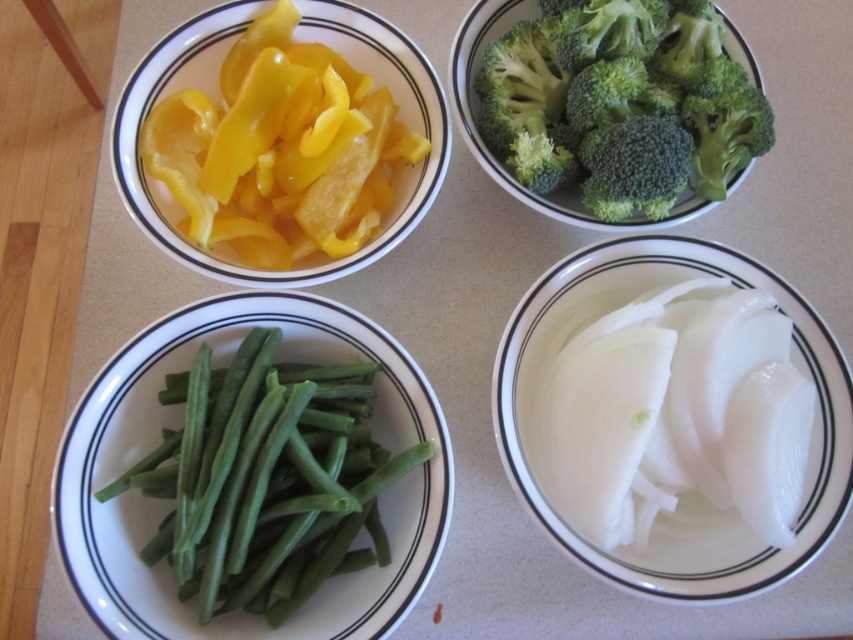
Which bowl is located at the coordinates point (178, 422)?

The green matte green beans at lower left is located at point (178, 422).

You are standing in front of the countertop with the bowls. Which bowl is closer to you, the green matte green beans at lower left or the yellow glossy bell pepper at upper left?

The green matte green beans at lower left is closer to the viewer than the yellow glossy bell pepper at upper left.